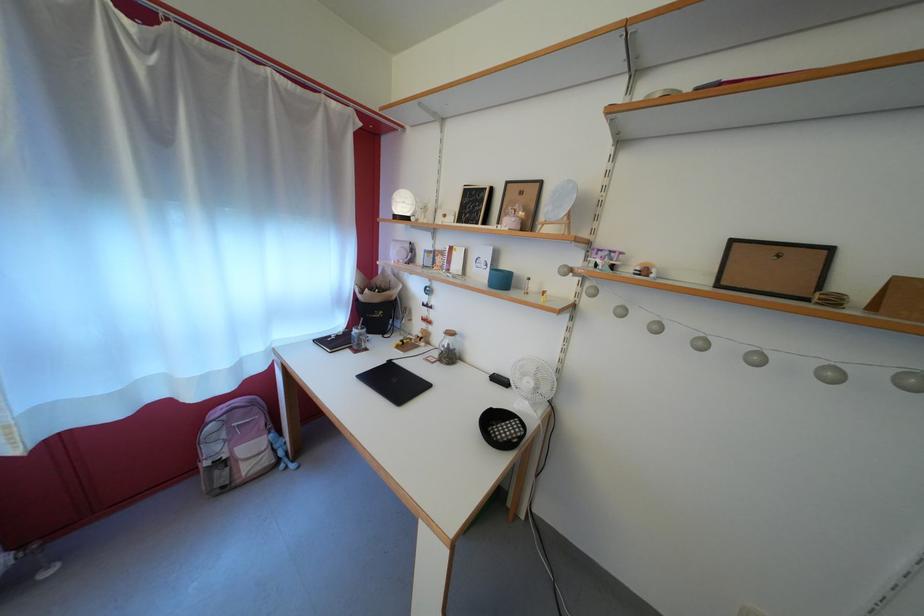
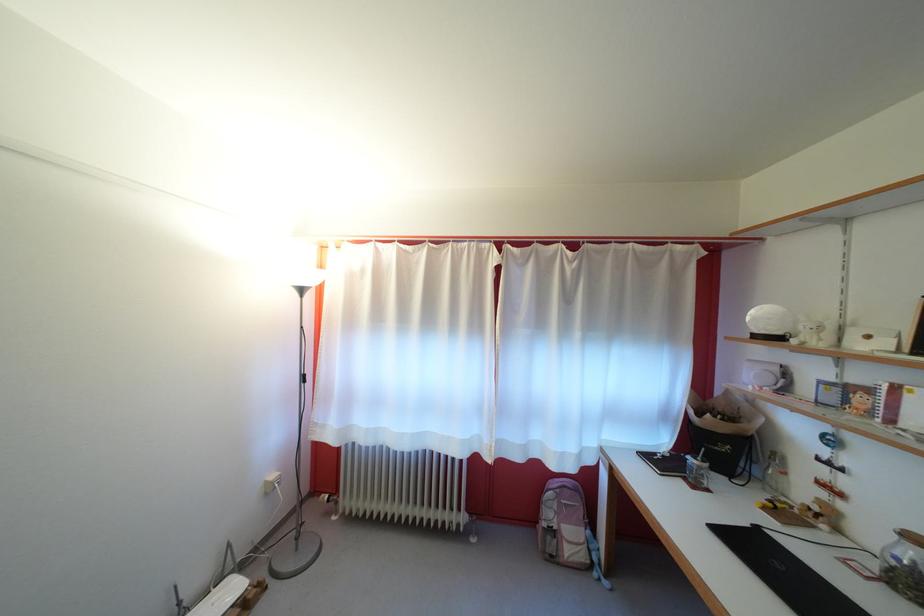
The point at (444, 361) is marked in the first image. Where is the corresponding point in the second image?

(881, 570)